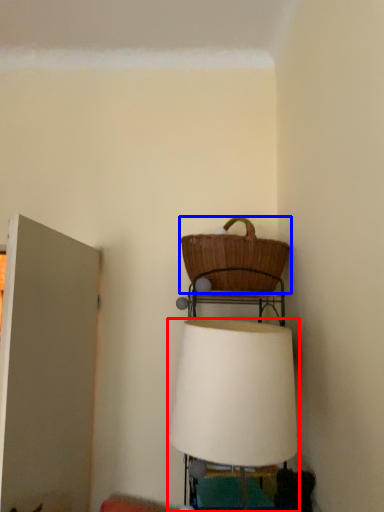
Question: Which point is closer to the camera, lamp (highlighted by a red box) or picnic basket (highlighted by a blue box)?

Choices:
 (A) lamp
 (B) picnic basket

Answer: (A)